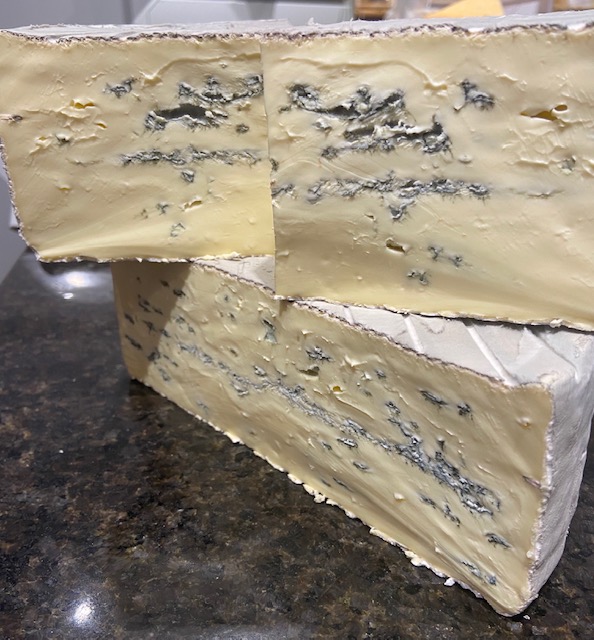
You are a GUI agent. You are given a task and a screenshot of the screen. Output one action in this format:
    pyautogui.click(x=<x>, y=<y>)
    Task: Click on the orange light
    The height and width of the screenshot is (640, 594).
    Given the screenshot: What is the action you would take?
    pyautogui.click(x=380, y=6)